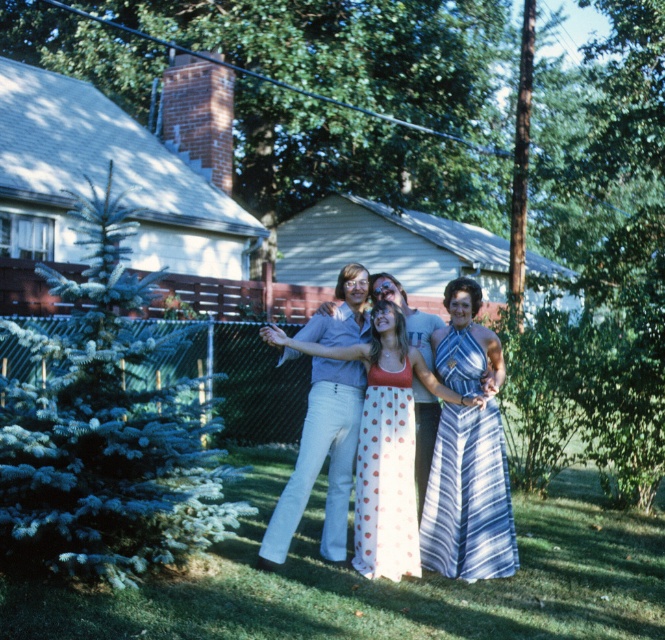
Question: Which of the following is the farthest from the observer?

Choices:
 (A) (336, 520)
 (B) (448, 410)
 (C) (412, 522)

Answer: (A)

Question: Can you confirm if blue striped dress at center is positioned to the right of white polka dot fabric dress at center?

Choices:
 (A) no
 (B) yes

Answer: (B)

Question: Can you confirm if polka dot dress at center is thinner than blue striped dress at center?

Choices:
 (A) yes
 (B) no

Answer: (B)

Question: Considering the relative positions of blue striped dress at center and white polka dot fabric dress at center in the image provided, where is blue striped dress at center located with respect to white polka dot fabric dress at center?

Choices:
 (A) right
 (B) left

Answer: (A)

Question: Which of these objects is positioned farthest from the polka dot dress at center?

Choices:
 (A) white cotton pants at center
 (B) white polka dot fabric dress at center
 (C) blue striped dress at center

Answer: (A)

Question: Among these points, which one is farthest from the camera?

Choices:
 (A) (329, 513)
 (B) (376, 372)
 (C) (358, 481)

Answer: (A)